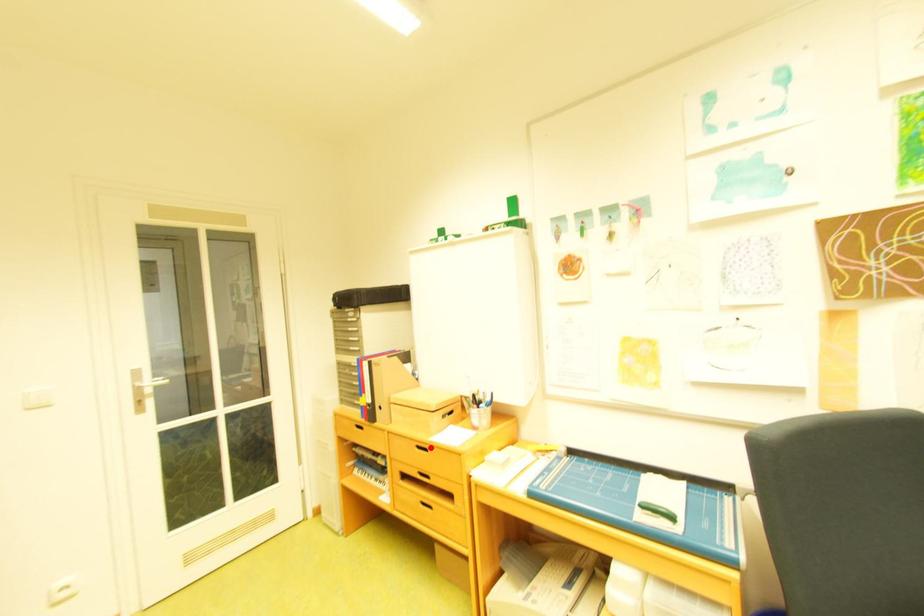
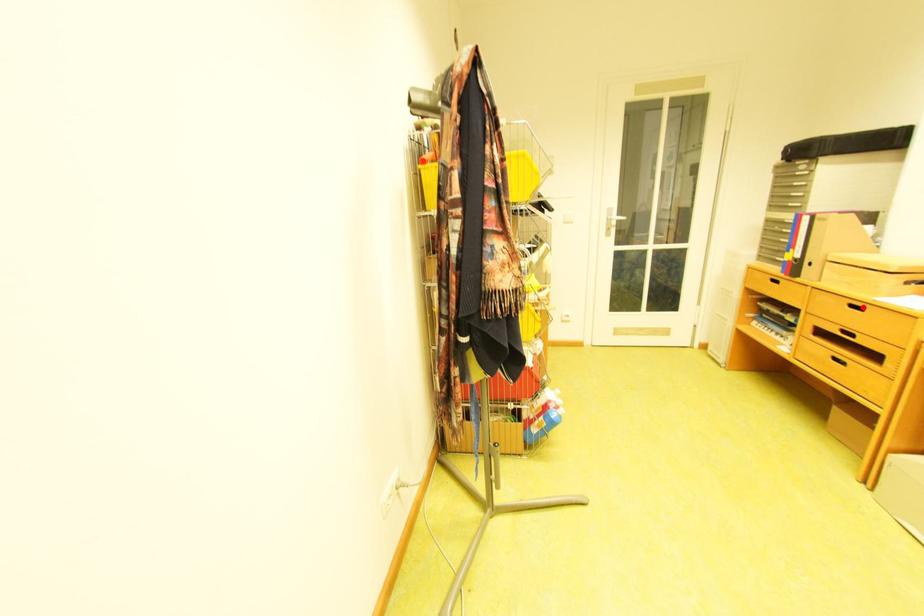
I am providing you with two images of the same scene from different viewpoints. A red point is marked on the first image and another point is marked on the second image. Is the red point in image1 aligned with the point shown in image2?

Yes